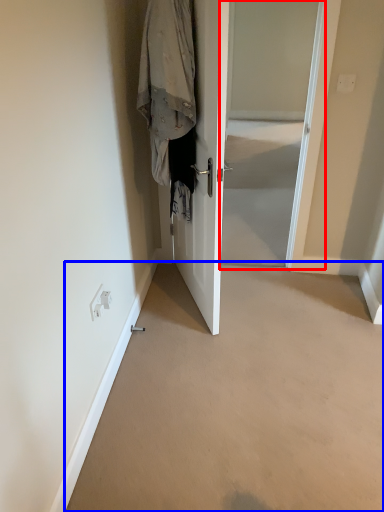
Question: Among these objects, which one is nearest to the camera, screen door (highlighted by a red box) or corridor (highlighted by a blue box)?

Choices:
 (A) screen door
 (B) corridor

Answer: (B)